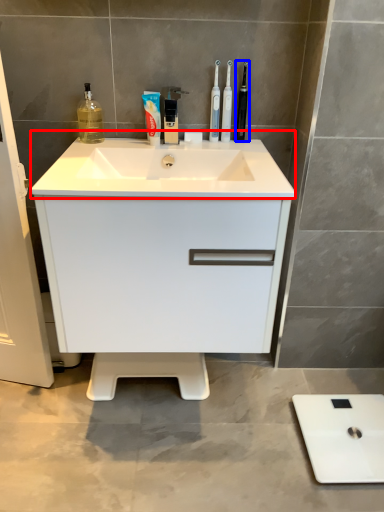
Question: Which point is further to the camera, sink (highlighted by a red box) or toothbrush (highlighted by a blue box)?

Choices:
 (A) sink
 (B) toothbrush

Answer: (B)